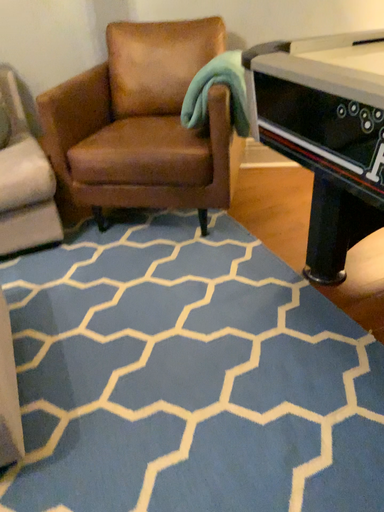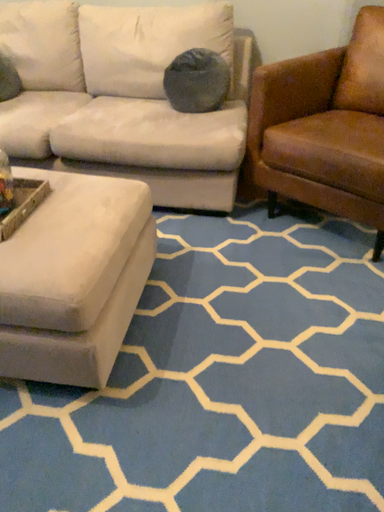
Question: How did the camera likely rotate when shooting the video?

Choices:
 (A) rotated left
 (B) rotated right

Answer: (A)